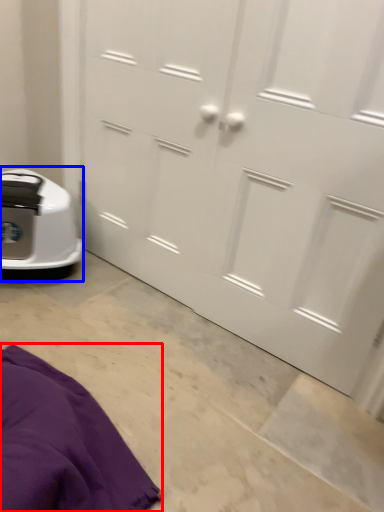
Question: Which object appears closest to the camera in this image, blanket (highlighted by a red box) or home appliance (highlighted by a blue box)?

Choices:
 (A) blanket
 (B) home appliance

Answer: (A)